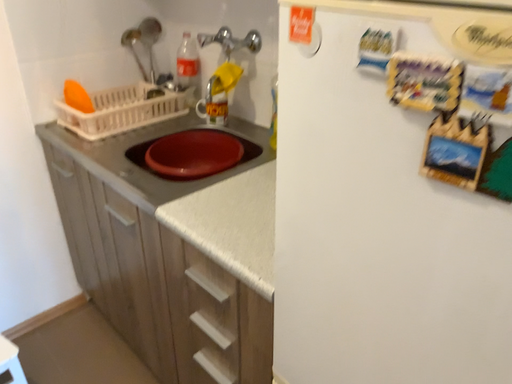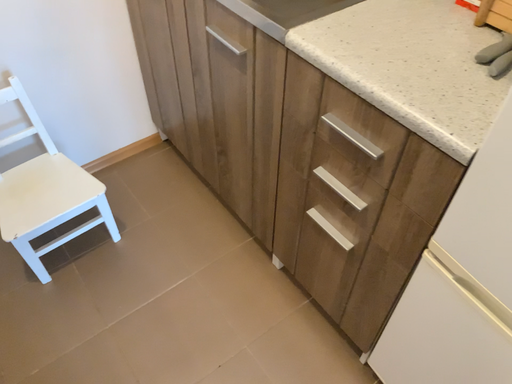
Question: How did the camera likely rotate when shooting the video?

Choices:
 (A) rotated downward
 (B) rotated upward

Answer: (A)